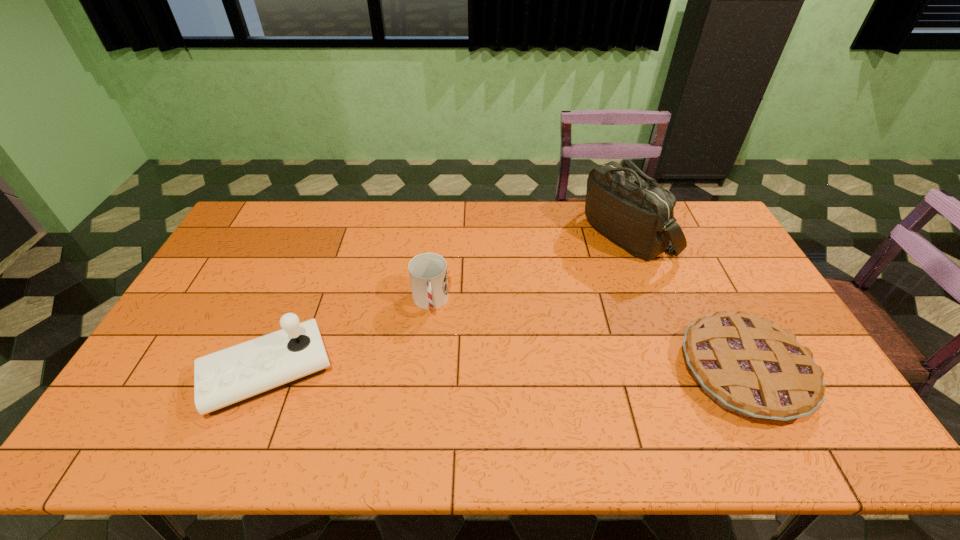
Where is `free area in between the pie and the leftmost object`? free area in between the pie and the leftmost object is located at coordinates (506, 372).

This screenshot has width=960, height=540. What are the coordinates of `unoccupied position between the second object from left to right and the leftmost object` in the screenshot? It's located at (349, 337).

Locate an element on the screen. The image size is (960, 540). free area in between the pie and the second tallest object is located at coordinates [x=506, y=372].

Locate an element on the screen. Image resolution: width=960 pixels, height=540 pixels. vacant area that lies between the shortest object and the third shortest object is located at coordinates (506, 372).

Identify the location of free space between the shoulder bag and the shortest object. (685, 303).

Identify the location of free space between the leftmost object and the farthest object. (447, 303).

Where is `the closest object to the joystick`? Image resolution: width=960 pixels, height=540 pixels. the closest object to the joystick is located at coordinates (428, 271).

Choose which object is the third nearest neighbor to the farthest object. Please provide its 2D coordinates. Your answer should be formatted as a tuple, i.e. [(x, y)], where the tuple contains the x and y coordinates of a point satisfying the conditions above.

[(224, 379)]

I want to click on vacant space that satisfies the following two spatial constraints: 1. on the back side of the farthest object; 2. on the right side of the second object from left to right, so click(x=438, y=234).

In order to click on vacant point that satisfies the following two spatial constraints: 1. on the back side of the tallest object; 2. on the right side of the second farthest object in this screenshot , I will do `click(438, 234)`.